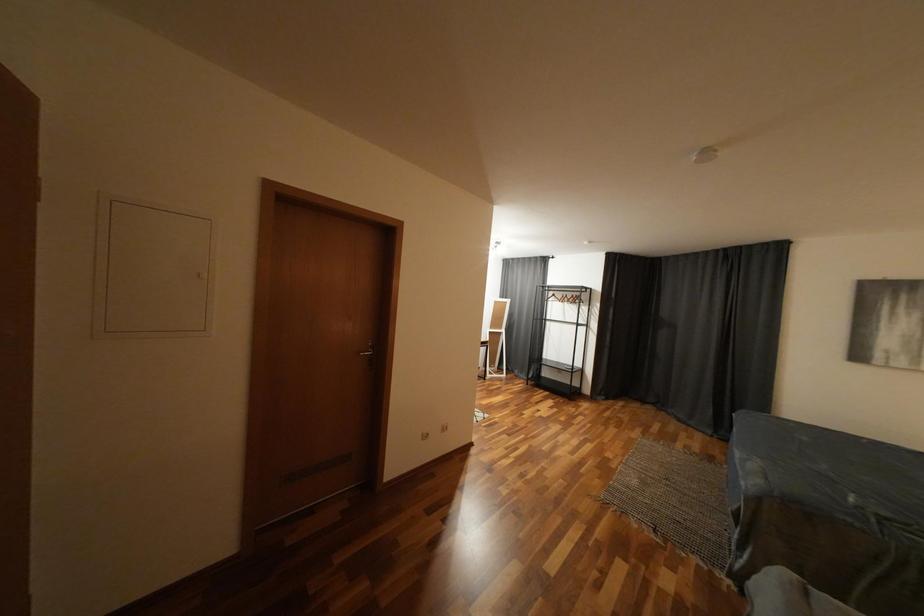
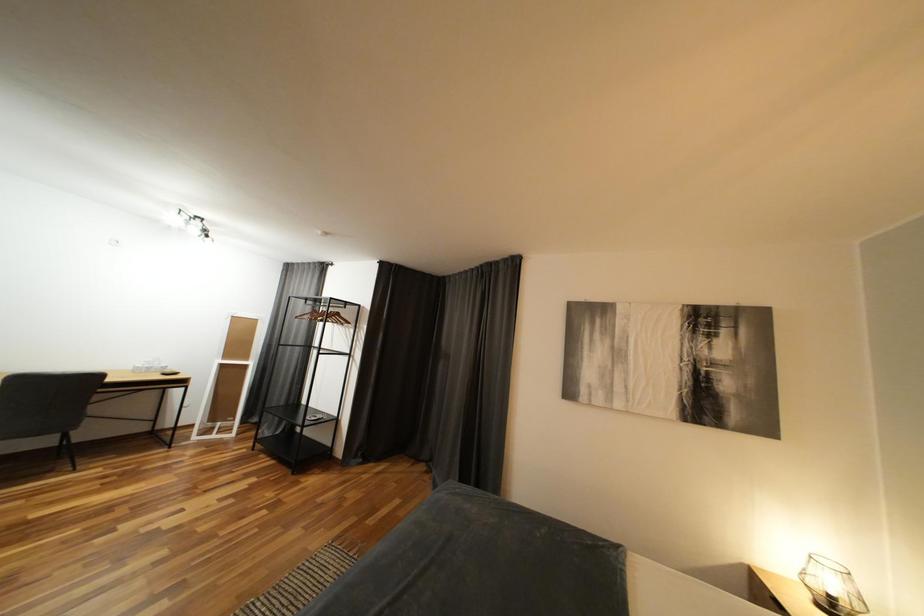
In a continuous first-person perspective shot, in which direction is the camera moving?

The movement direction of the cameraman is right, forward.